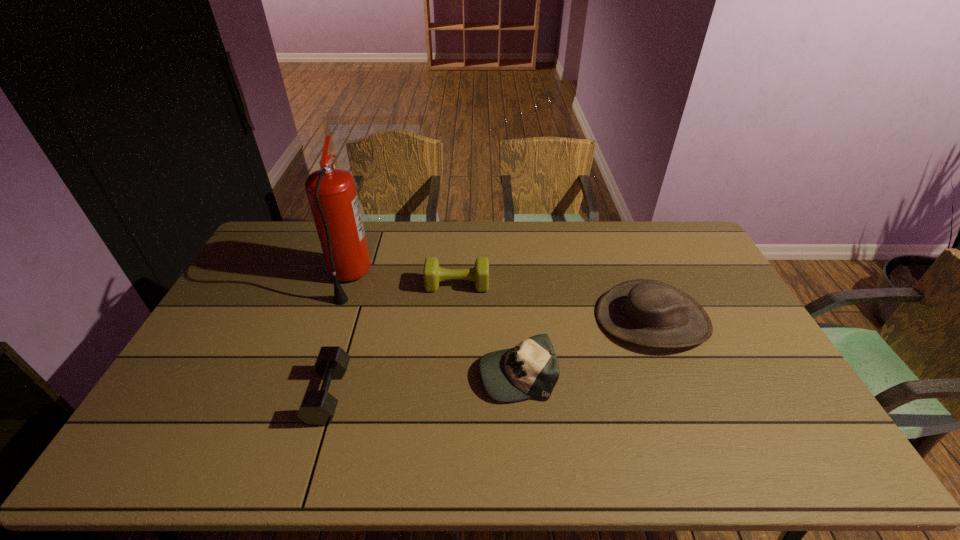
Where is `free space located 0.070m on the front-facing side of the baseball cap`? The width and height of the screenshot is (960, 540). free space located 0.070m on the front-facing side of the baseball cap is located at coordinates (454, 373).

Where is `vacant space located 0.300m on the back of the left dumbbell`? Image resolution: width=960 pixels, height=540 pixels. vacant space located 0.300m on the back of the left dumbbell is located at coordinates (359, 294).

At what (x,y) coordinates should I click in order to perform the action: click on object present at the far edge. Please return your answer as a coordinate pair (x, y). Looking at the image, I should click on click(331, 192).

Where is `object present at the right edge`? This screenshot has width=960, height=540. object present at the right edge is located at coordinates (650, 313).

In the image, there is a desktop. At what (x,y) coordinates should I click in order to perform the action: click on vacant space at the far edge. Please return your answer as a coordinate pair (x, y). This screenshot has width=960, height=540. Looking at the image, I should click on (579, 258).

The height and width of the screenshot is (540, 960). I want to click on vacant space at the near edge of the desktop, so click(x=732, y=462).

At what (x,y) coordinates should I click in order to perform the action: click on blank area at the left edge. Please return your answer as a coordinate pair (x, y). This screenshot has width=960, height=540. Looking at the image, I should click on (169, 429).

This screenshot has height=540, width=960. Identify the location of blank space at the right edge. (794, 393).

Locate an element on the screen. The image size is (960, 540). vacant point at the near right corner is located at coordinates (779, 467).

You are a GUI agent. You are given a task and a screenshot of the screen. Output one action in this format:
    pyautogui.click(x=<x>, y=<y>)
    Task: Click on the empty space that is in between the rightmost object and the baseball cap
    
    Given the screenshot: What is the action you would take?
    pyautogui.click(x=585, y=346)